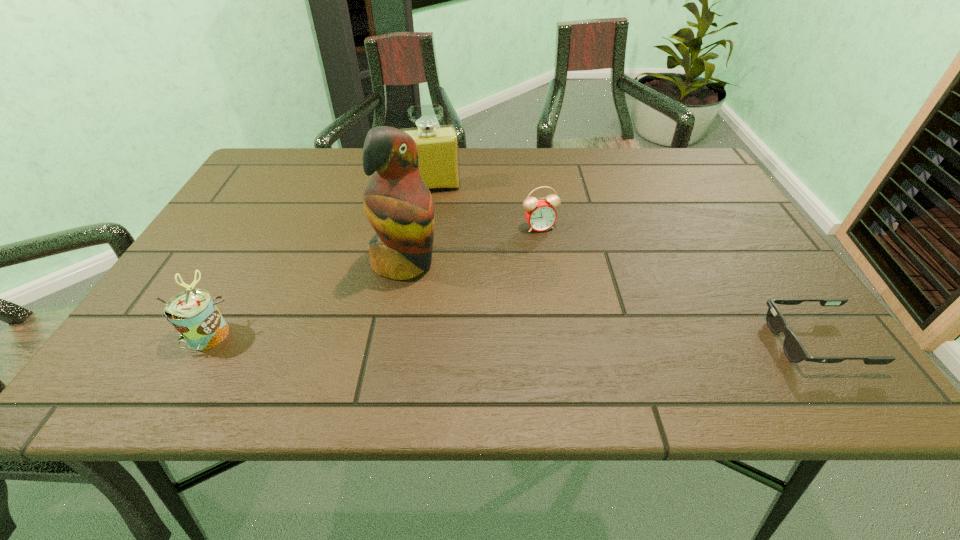
Identify the location of vacant area between the parrot and the fourth object from left to right. (472, 245).

The height and width of the screenshot is (540, 960). I want to click on free spot between the leftmost object and the sunglasses, so click(512, 338).

Locate an element on the screen. This screenshot has width=960, height=540. vacant region between the fourth tallest object and the second tallest object is located at coordinates (486, 207).

The image size is (960, 540). What are the coordinates of `empty space between the alarm clock and the fourth shortest object` in the screenshot? It's located at (486, 207).

Where is `free spot between the third tallest object and the fourth tallest object`? free spot between the third tallest object and the fourth tallest object is located at coordinates (373, 280).

Identify which object is located as the second nearest to the fourth shortest object. Please provide its 2D coordinates. Your answer should be formatted as a tuple, i.e. [(x, y)], where the tuple contains the x and y coordinates of a point satisfying the conditions above.

[(399, 206)]

Point out which object is positioned as the third nearest to the can. Please provide its 2D coordinates. Your answer should be formatted as a tuple, i.e. [(x, y)], where the tuple contains the x and y coordinates of a point satisfying the conditions above.

[(540, 214)]

You are a GUI agent. You are given a task and a screenshot of the screen. Output one action in this format:
    pyautogui.click(x=<x>, y=<y>)
    Task: Click on the free point that satisfies the following two spatial constraints: 1. on the back side of the can; 2. on the right side of the alarm clock
    The image size is (960, 540).
    Given the screenshot: What is the action you would take?
    pyautogui.click(x=268, y=227)